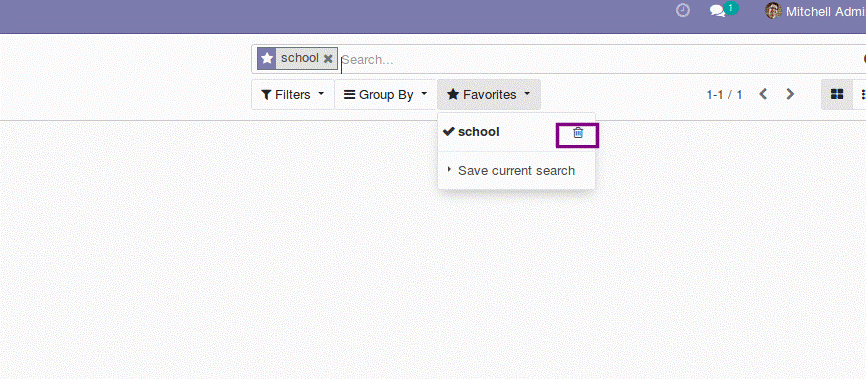
This screenshot has height=379, width=866. What are the coordinates of `trash` in the screenshot? It's located at (572, 137).